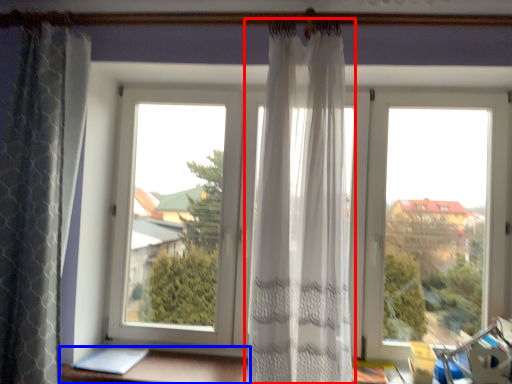
Question: Which object is further to the camera taking this photo, curtain (highlighted by a red box) or furniture (highlighted by a blue box)?

Choices:
 (A) curtain
 (B) furniture

Answer: (B)